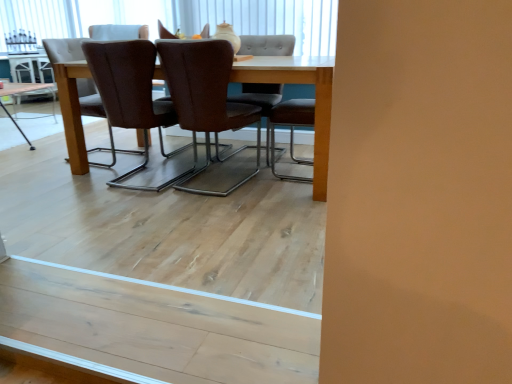
Question: Is brown leather chair at center, which appears as the 3th chair when viewed from the front, positioned with its back to light wood table at center, which is the second table from top to bottom?

Choices:
 (A) yes
 (B) no

Answer: (B)

Question: Does brown leather chair at center, which appears as the 3th chair when viewed from the front, have a lesser width compared to light wood table at center, which is the first table in front-to-back order?

Choices:
 (A) no
 (B) yes

Answer: (B)

Question: Is the depth of brown leather chair at center, the 3th chair when ordered from back to front, greater than that of light wood table at center, which appears as the first table when ordered from the bottom?

Choices:
 (A) yes
 (B) no

Answer: (B)

Question: Is brown leather chair at center, which appears as the 3th chair when viewed from the front, directly adjacent to light wood table at center, which appears as the first table when ordered from the bottom?

Choices:
 (A) no
 (B) yes

Answer: (A)

Question: Considering the relative positions of brown leather chair at center, the 3th chair when ordered from back to front, and light wood table at center, which is the 1th table in right-to-left order, in the image provided, is brown leather chair at center, the 3th chair when ordered from back to front, in front of light wood table at center, which is the 1th table in right-to-left order,?

Choices:
 (A) no
 (B) yes

Answer: (B)

Question: Is brown leather chair at center, which appears as the 3th chair when viewed from the front, oriented towards light wood table at center, the 2th table viewed from the back?

Choices:
 (A) no
 (B) yes

Answer: (A)

Question: Can you confirm if light wood table at center, which appears as the second table when viewed from the left, is positioned to the right of light wood table at center, the second table when ordered from bottom to top?

Choices:
 (A) no
 (B) yes

Answer: (B)

Question: Is light wood table at center, which appears as the second table when viewed from the left, wider than light wood table at center, the second table when ordered from bottom to top?

Choices:
 (A) no
 (B) yes

Answer: (B)

Question: Is light wood table at center, which appears as the first table when ordered from the bottom, facing towards light wood table at center, which is the first table from back to front?

Choices:
 (A) yes
 (B) no

Answer: (B)

Question: Can you confirm if light wood table at center, which is the second table from top to bottom, is bigger than light wood table at center, the 1th table viewed from the left?

Choices:
 (A) yes
 (B) no

Answer: (A)

Question: Can you confirm if light wood table at center, which is the first table in front-to-back order, is shorter than light wood table at center, the 1th table viewed from the left?

Choices:
 (A) no
 (B) yes

Answer: (B)

Question: From the image's perspective, is light wood table at center, the 2th table viewed from the back, below light wood table at center, which is the first table from back to front?

Choices:
 (A) yes
 (B) no

Answer: (A)

Question: Is light wood table at center, the 1th table viewed from the left, at the right side of brown leather chair at center, acting as the 2th chair starting from the front?

Choices:
 (A) no
 (B) yes

Answer: (A)